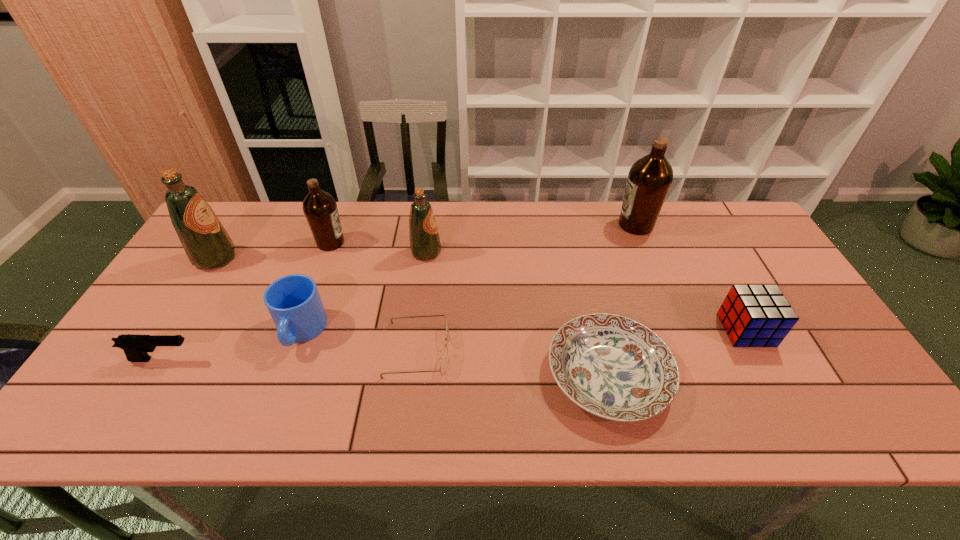
Locate an element on the screen. The height and width of the screenshot is (540, 960). the bigger green olive oil is located at coordinates (207, 244).

Find the location of a particular element. the leftmost olive oil is located at coordinates click(207, 244).

Identify the location of the rightmost olive oil. This screenshot has height=540, width=960. (650, 177).

Identify the location of the bigger brown olive oil. The width and height of the screenshot is (960, 540). (650, 177).

Where is `the right green olive oil`? the right green olive oil is located at coordinates (425, 244).

Where is `the smaller green olive oil`? the smaller green olive oil is located at coordinates (425, 244).

Find the location of a particular element. This screenshot has width=960, height=540. the smaller brown olive oil is located at coordinates (320, 209).

Where is `the third olive oil from right to left`? the third olive oil from right to left is located at coordinates (320, 209).

The width and height of the screenshot is (960, 540). Identify the location of mug. (293, 301).

Where is `the rightmost object`? the rightmost object is located at coordinates (752, 315).